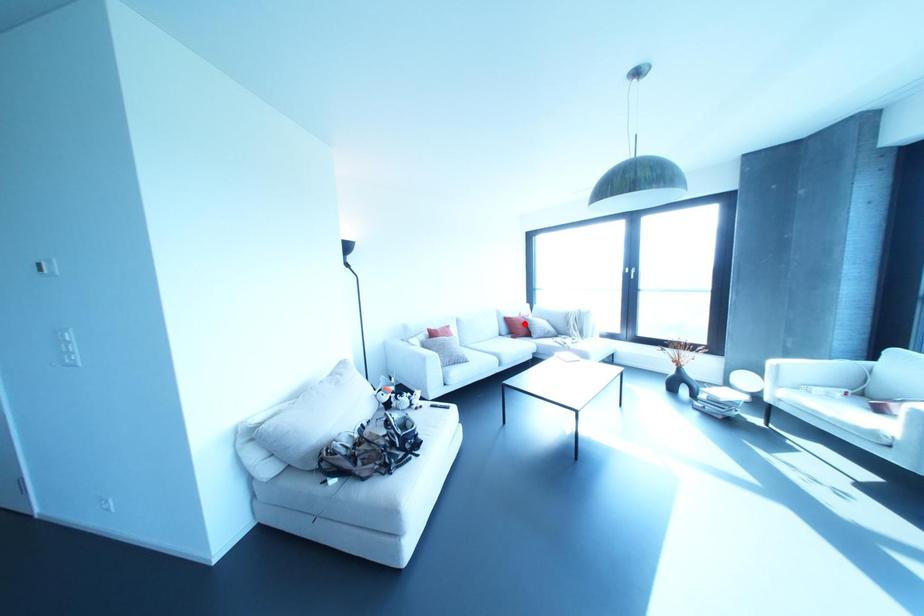
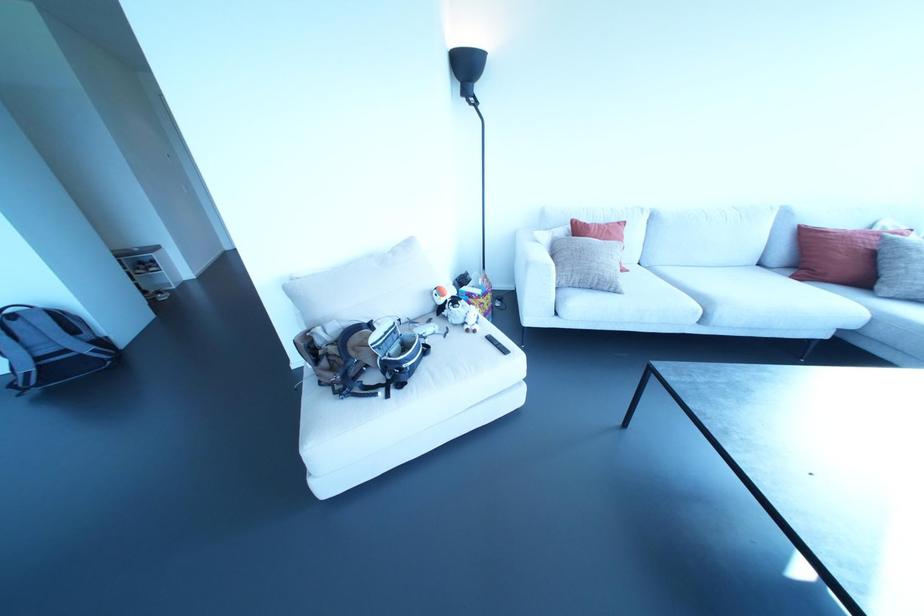
In the second image, find the point that corresponds to the highlighted location in the first image.

(872, 254)